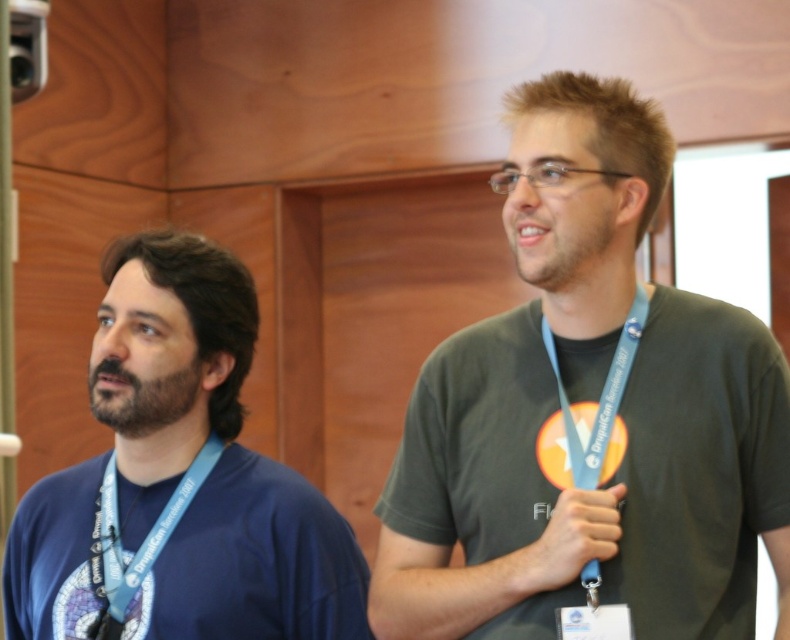
You are standing in front of the two individuals at the conference. You want to take a photo of the point at coordinate point (x=215, y=445). Is the point within your camera range of 5 feet?

The point (x=215, y=445) is 5.35 feet away from the camera, so it is slightly out of the 5 feet range.